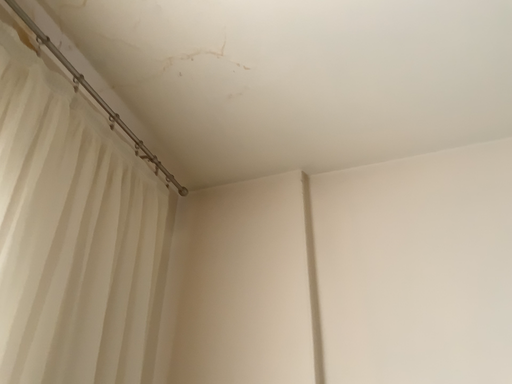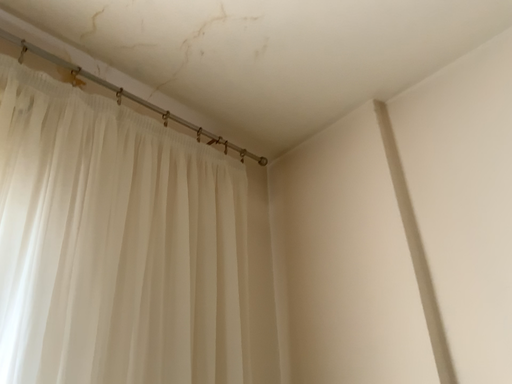
Question: How did the camera likely rotate when shooting the video?

Choices:
 (A) rotated left
 (B) rotated right

Answer: (A)